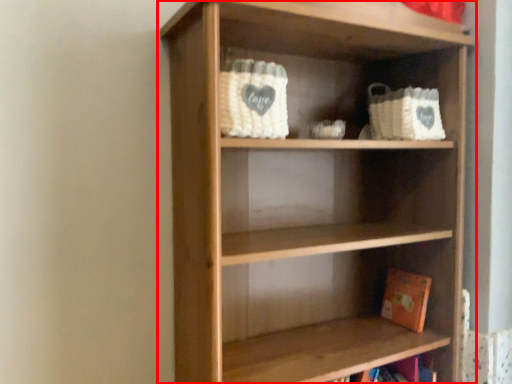
Question: Observing the image, what is the correct spatial positioning of shelf (annotated by the red box) in reference to book?

Choices:
 (A) right
 (B) left

Answer: (B)